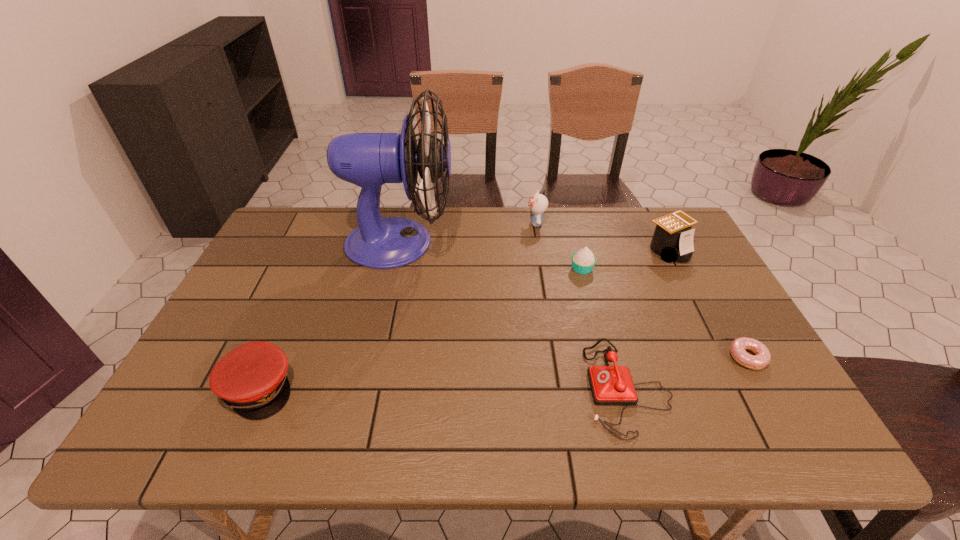
The height and width of the screenshot is (540, 960). Identify the location of vacant space located 0.110m on the front-facing side of the third object from left to right. (493, 223).

Locate an element on the screen. This screenshot has height=540, width=960. vacant space located 0.400m on the front of the calculator is located at coordinates (731, 374).

Locate an element on the screen. The width and height of the screenshot is (960, 540). free point located on the left of the cupcake is located at coordinates (440, 268).

I want to click on free space located on the front-facing side of the cap, so click(433, 388).

This screenshot has height=540, width=960. Find the location of `vacant point located 0.120m on the dial of the telephone`. vacant point located 0.120m on the dial of the telephone is located at coordinates (533, 387).

Find the location of a particular element. This screenshot has width=960, height=540. vacant position located 0.200m on the dial of the telephone is located at coordinates (498, 387).

Find the location of a particular element. The height and width of the screenshot is (540, 960). free point located 0.180m on the dial of the telephone is located at coordinates (507, 387).

The height and width of the screenshot is (540, 960). Identify the location of free spot located 0.240m on the left of the shortest object. [x=631, y=357].

I want to click on fan that is at the far edge, so click(369, 160).

This screenshot has width=960, height=540. Identify the location of kitten present at the far edge. (538, 203).